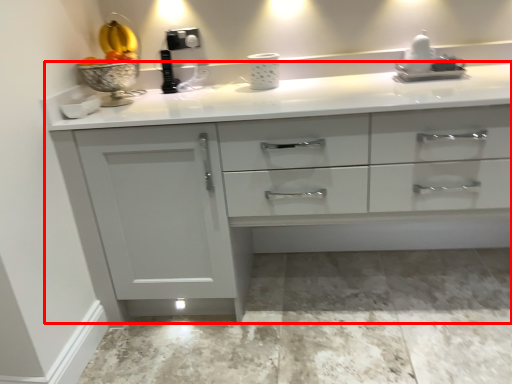
Question: From the image's perspective, what is the correct spatial positioning of countertop (annotated by the red box) in reference to sink?

Choices:
 (A) below
 (B) above

Answer: (A)